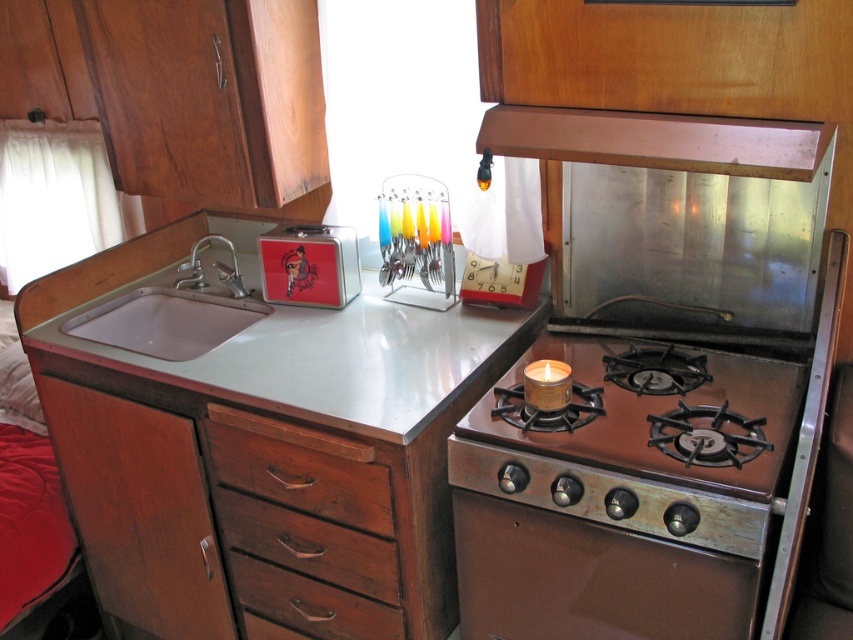
You are a chef preparing to cook a meal and need to place a pot on the shiny metallic gas stove at right. There is also a small, red metal box with a graphic design on its lid nearby. Can you determine the spatial relationship between the stove and the box to ensure there is enough space for the pot?

The shiny metallic gas stove at right is located at point (653, 412), while the small, red metal box with a graphic design on its lid is positioned to the right of the sink. Since the stove is at a specific coordinate, you should check the distance between them to ensure the pot fits comfortably without obstruction.

You are a chef preparing to place a large baking tray on the kitchen counter. The tray is too big for the brown metallic oven at center. Can it fit on the shiny metallic gas stove at right instead?

The brown metallic oven at center has a lesser width compared to the shiny metallic gas stove at right. Since the tray is too big for the oven, it might fit on the stove if the stove is wider. However, the description only states the oven is narrower, so the stove is wider. Therefore, the tray could fit on the shiny metallic gas stove at right.

You are organizing the kitchen and need to place a new spice jar. The spice jar needs to be placed above the wooden drawer at lower left but below the white glossy sink at left. Is there enough vertical space between them for the jar?

The wooden drawer at lower left is located below the white glossy sink at left, so there is vertical space between them where the spice jar can be placed.